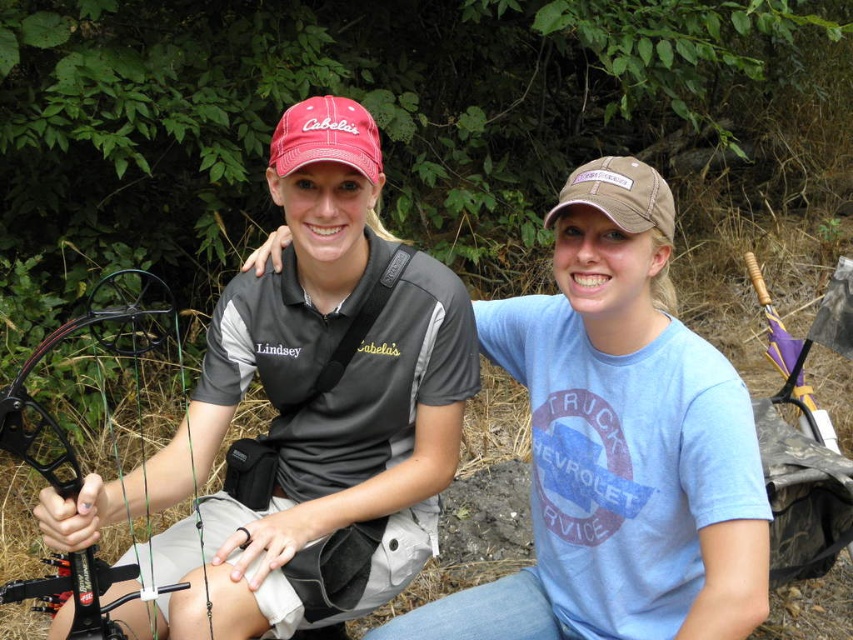
Based on the photo, who is taller, matte gray shirt at center or light blue cotton t-shirt at center?

matte gray shirt at center is taller.

Is point (231, 529) more distant than point (625, 552)?

Yes, point (231, 529) is behind point (625, 552).

Between point (57, 632) and point (604, 509), which one is positioned in front?

Point (57, 632) is in front.

Identify the location of matte gray shirt at center. (335, 474).

Can you confirm if light blue cotton t-shirt at center is thinner than black composite bow at left?

No, light blue cotton t-shirt at center is not thinner than black composite bow at left.

Can you confirm if light blue cotton t-shirt at center is positioned to the right of black composite bow at left?

Indeed, light blue cotton t-shirt at center is positioned on the right side of black composite bow at left.

Where is `light blue cotton t-shirt at center`? The height and width of the screenshot is (640, 853). light blue cotton t-shirt at center is located at coordinates (619, 444).

Identify the location of light blue cotton t-shirt at center. This screenshot has width=853, height=640. (619, 444).

Is point (286, 506) positioned behind point (9, 593)?

Yes, it is behind point (9, 593).

Which is more to the left, matte gray shirt at center or black composite bow at left?

black composite bow at left

Which is behind, point (268, 387) or point (67, 356)?

Positioned behind is point (67, 356).

Locate an element on the screen. matte gray shirt at center is located at coordinates (335, 474).